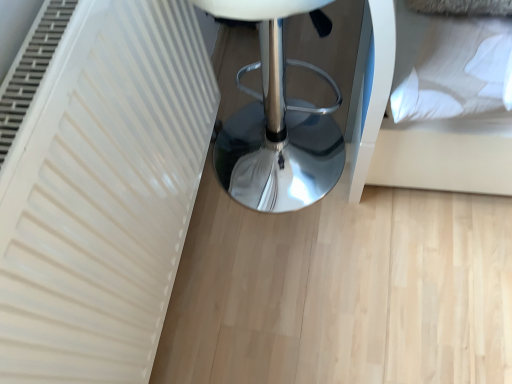
Identify the location of vacant region in front of white glossy stool at center. (323, 264).